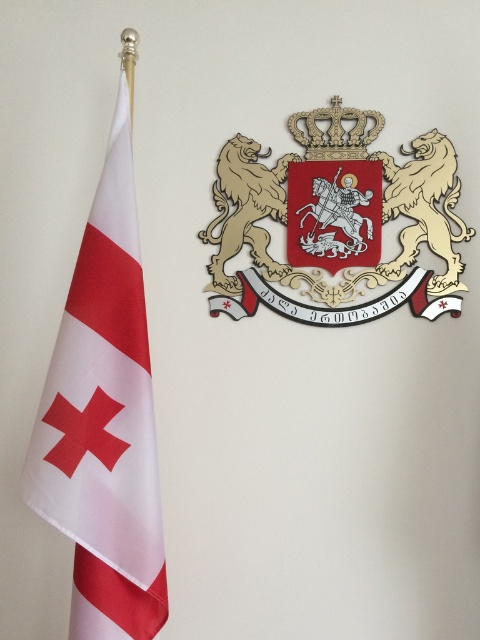
You are standing in front of a wall with a flag and a coat of arms. There is a specific point marked at coordinates (104, 420). Which object is this point associated with?

The point at (104, 420) is associated with the white fabric flag at left as stated in the objects description.

You are standing in front of the wall with the flag and coat of arms. There are two points marked on the wall at coordinates point [164,582] and point [243,163]. Which point is nearer to you?

Point [164,582] is closer to the camera than point [243,163], so the point [164,582] is nearer to you.